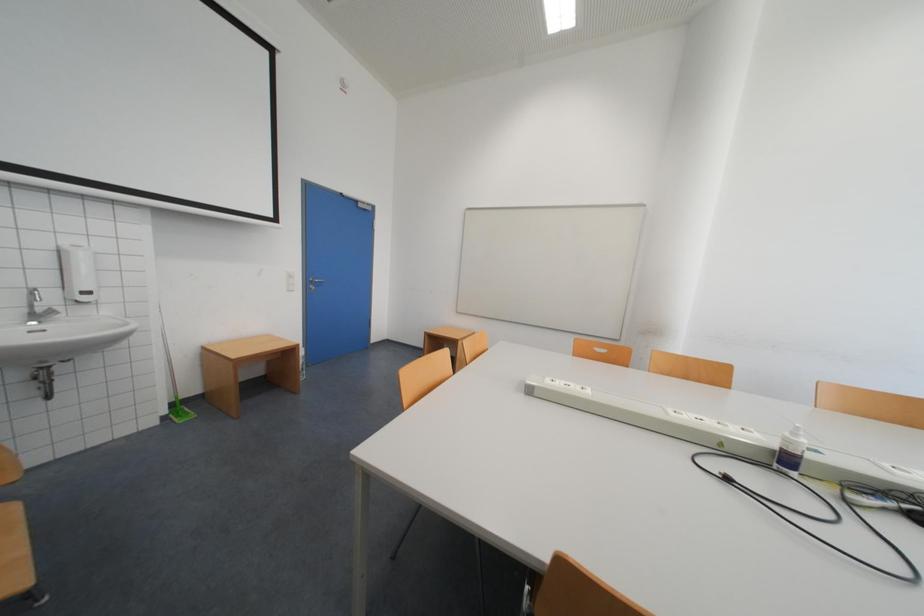
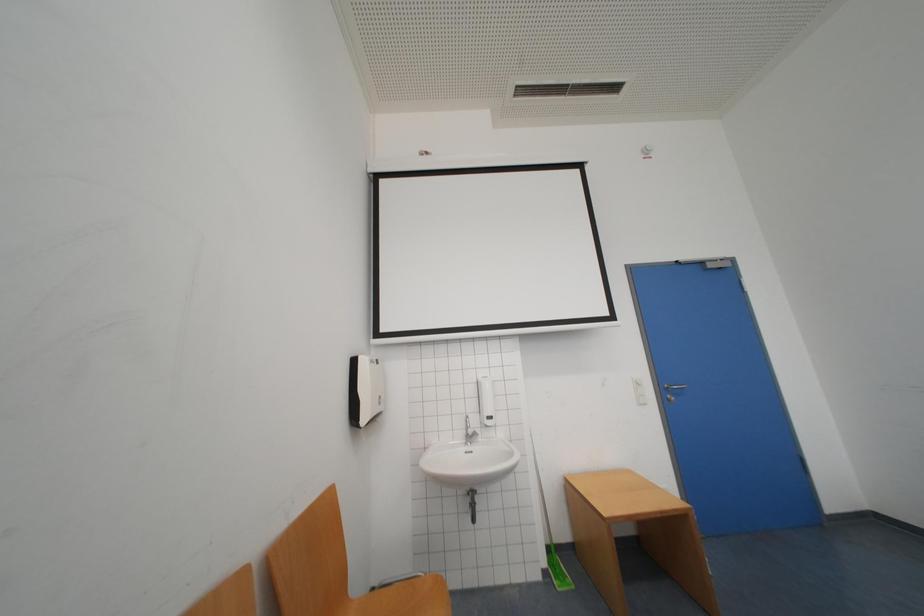
How did the camera likely rotate?

The camera rotated toward left-up.